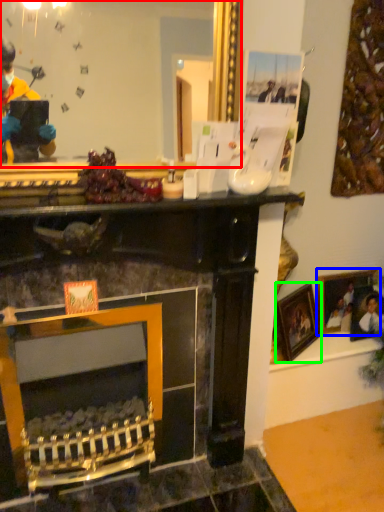
Question: Which object is the farthest from mirror (highlighted by a red box)? Choose among these: picture frame (highlighted by a blue box) or picture frame (highlighted by a green box).

Choices:
 (A) picture frame
 (B) picture frame

Answer: (A)